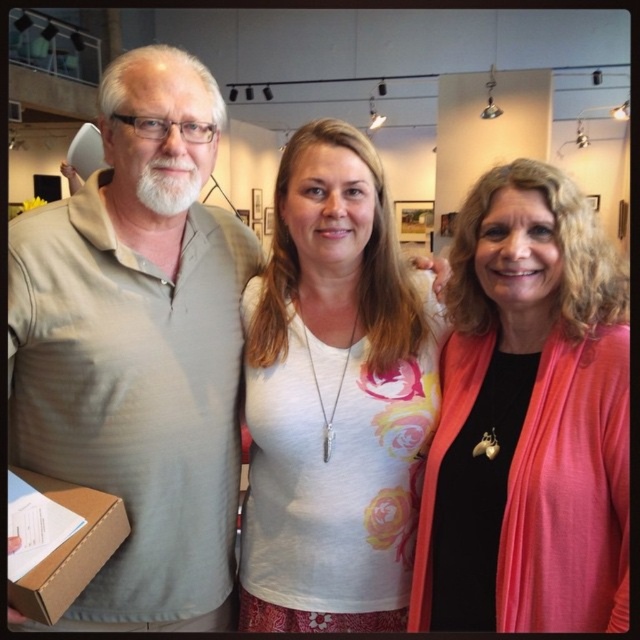
Question: Is light beige cotton shirt at left bigger than white floral shirt at center?

Choices:
 (A) yes
 (B) no

Answer: (A)

Question: Which object appears closest to the camera in this image?

Choices:
 (A) white floral shirt at center
 (B) light beige cotton shirt at left
 (C) brown cardboard box at lower left
 (D) pink matte cardigan at center

Answer: (D)

Question: Does pink matte cardigan at center have a greater width compared to white floral shirt at center?

Choices:
 (A) yes
 (B) no

Answer: (B)

Question: Is light beige cotton shirt at left below pink matte cardigan at center?

Choices:
 (A) yes
 (B) no

Answer: (B)

Question: Considering the real-world distances, which object is closest to the brown cardboard box at lower left?

Choices:
 (A) pink matte cardigan at center
 (B) white floral shirt at center
 (C) light beige cotton shirt at left

Answer: (C)

Question: Which of the following is the farthest from the observer?

Choices:
 (A) light beige cotton shirt at left
 (B) brown cardboard box at lower left
 (C) white floral shirt at center
 (D) pink matte cardigan at center

Answer: (C)